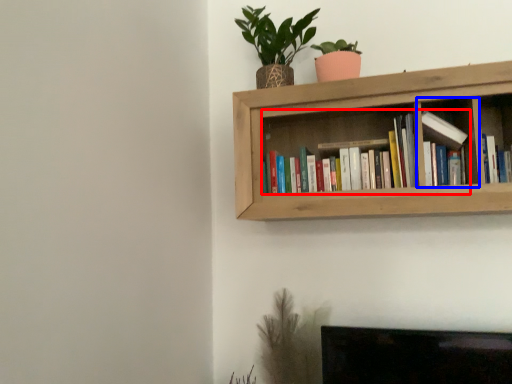
Question: Which object appears farthest to the camera in this image, book (highlighted by a red box) or cabinet (highlighted by a blue box)?

Choices:
 (A) book
 (B) cabinet

Answer: (A)